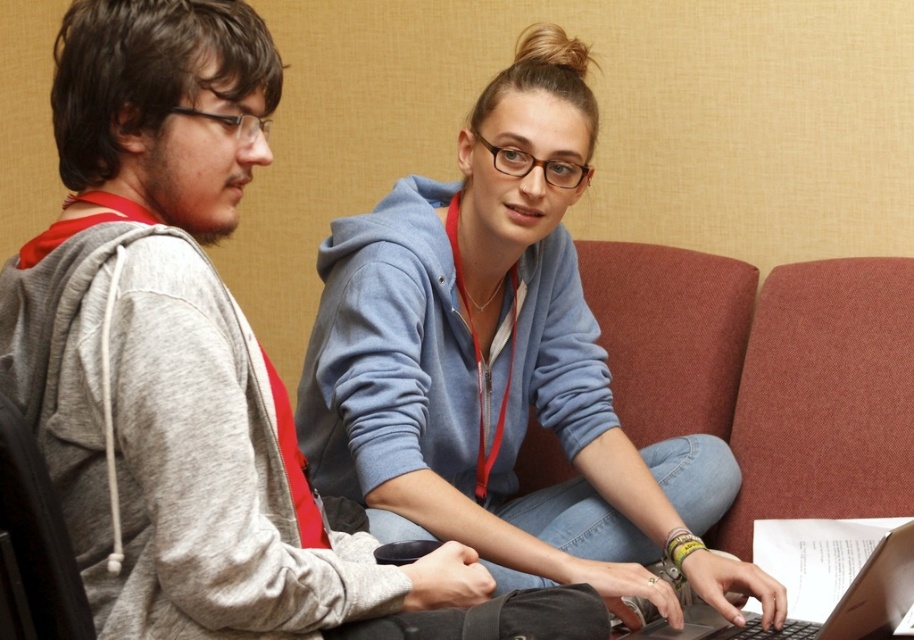
You are a photographer trying to capture a candid shot of the blue fleece hoodie at center. The camera you are using has a focal point locked at point (505, 369). Will the blue fleece hoodie at center be in focus?

The blue fleece hoodie at center is located at point (505, 369), so yes, the blue fleece hoodie at center will be in focus since the focal point is exactly at that coordinate.

You are planning to place a new accessory on the desk in the image. The accessory requires 15 cm of space. Considering the gray matte hoodie at upper left and the silver metallic laptop at center, which object can accommodate the accessory without overlapping?

The gray matte hoodie at upper left has a larger size compared to the silver metallic laptop at center, so it can accommodate the accessory without overlapping.

You are a photographer trying to capture a clear photo of the silver metallic laptop at center without including the blue fleece hoodie at center in the frame. Given their sizes, is this possible?

The blue fleece hoodie at center is bigger than the silver metallic laptop at center, so it might be challenging to frame the laptop without including the hoodie, especially if they are both positioned at the center of the image.